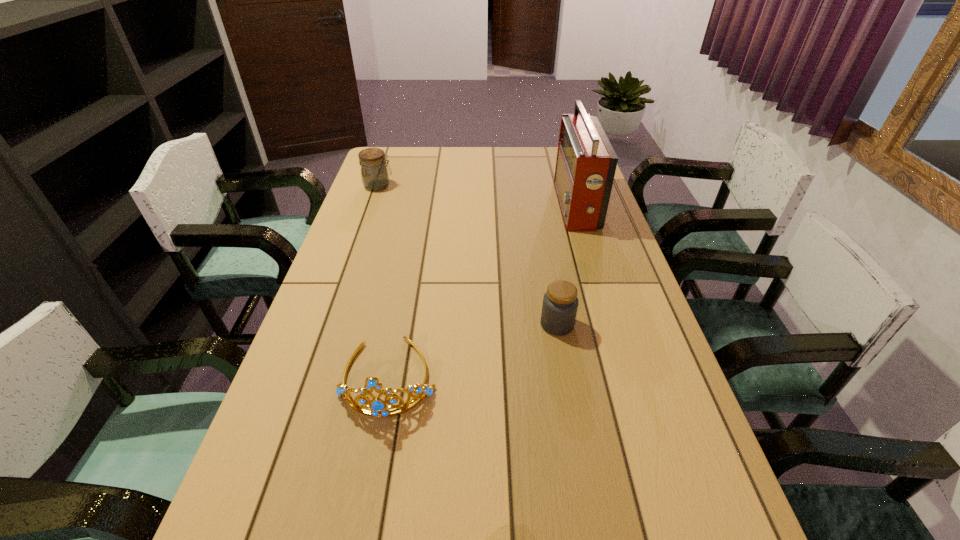
In the image, there is a desktop. At what (x,y) coordinates should I click in order to perform the action: click on free region at the left edge. Please return your answer as a coordinate pair (x, y). The height and width of the screenshot is (540, 960). Looking at the image, I should click on (350, 281).

Locate an element on the screen. This screenshot has width=960, height=540. vacant area at the right edge is located at coordinates (680, 488).

At what (x,y) coordinates should I click in order to perform the action: click on free spot between the radio receiver and the farther jar. Please return your answer as a coordinate pair (x, y). This screenshot has height=540, width=960. Looking at the image, I should click on (477, 196).

Find the location of a particular element. unoccupied position between the radio receiver and the nearest object is located at coordinates (482, 291).

Locate an element on the screen. This screenshot has width=960, height=540. free spot between the nearest object and the tallest object is located at coordinates (482, 291).

Where is `free space that is in between the left jar and the right jar`? This screenshot has width=960, height=540. free space that is in between the left jar and the right jar is located at coordinates (468, 255).

The image size is (960, 540). Identify the location of vacant area that lies between the right jar and the rightmost object. (566, 265).

Locate which object is the second closest to the radio receiver. Please provide its 2D coordinates. Your answer should be formatted as a tuple, i.e. [(x, y)], where the tuple contains the x and y coordinates of a point satisfying the conditions above.

[(379, 408)]

Identify which object is the closest to the second object from right to left. Please provide its 2D coordinates. Your answer should be formatted as a tuple, i.e. [(x, y)], where the tuple contains the x and y coordinates of a point satisfying the conditions above.

[(379, 408)]

You are a GUI agent. You are given a task and a screenshot of the screen. Output one action in this format:
    pyautogui.click(x=<x>, y=<y>)
    Task: Click on the vacant position in the image that satisfies the following two spatial constraints: 1. on the front-facing side of the rightmost object; 2. on the front-facing side of the tiara
    This screenshot has height=540, width=960.
    Given the screenshot: What is the action you would take?
    pyautogui.click(x=628, y=376)